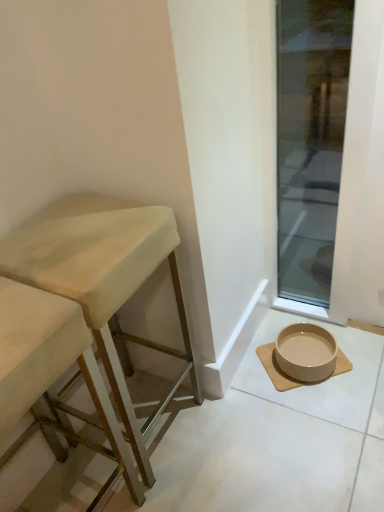
Question: Does point (13, 268) appear closer or farther from the camera than point (334, 35)?

Choices:
 (A) farther
 (B) closer

Answer: (B)

Question: In the image, is beige fabric stool at left, the 1th stool in the right-to-left sequence, positioned in front of or behind transparent glass door at lower right?

Choices:
 (A) behind
 (B) front

Answer: (B)

Question: Which of these objects is positioned farthest from the beige fabric stool at left, the 2th stool positioned from the left?

Choices:
 (A) beige ceramic bowl at lower right
 (B) beige ceramic bowl at lower right
 (C) wooden stool at left, which is the first stool in left-to-right order
 (D) transparent glass door at lower right

Answer: (D)

Question: Considering the real-world distances, which object is farthest from the beige ceramic bowl at lower right?

Choices:
 (A) transparent glass door at lower right
 (B) beige ceramic bowl at lower right
 (C) wooden stool at left, marked as the second stool in a right-to-left arrangement
 (D) beige fabric stool at left, the 1th stool in the right-to-left sequence

Answer: (A)